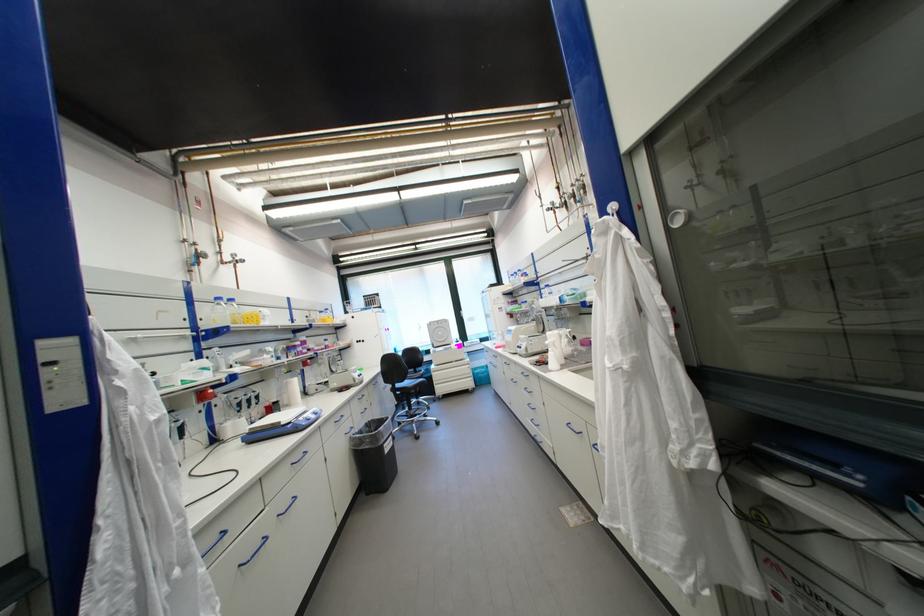
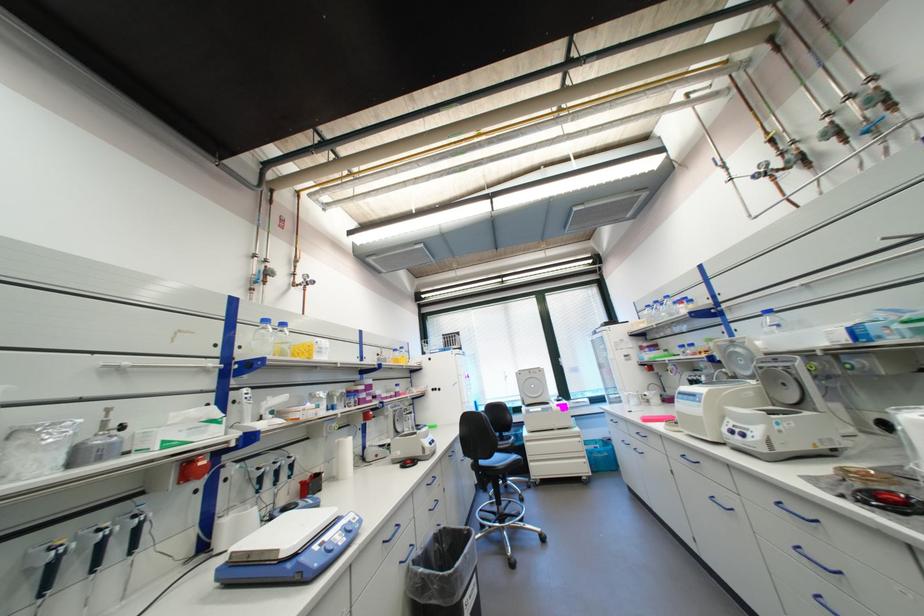
Find the pixel in the second image that matches (365,408) in the first image.

(431, 501)